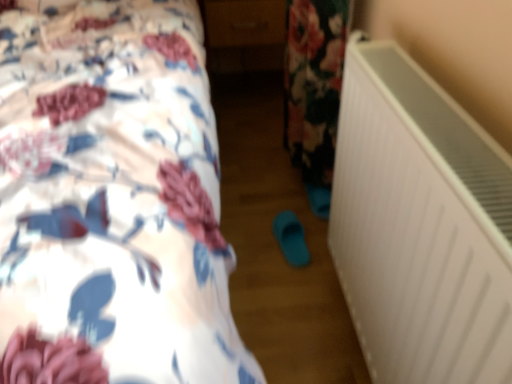
Where is `matte brown drawer at center`? The height and width of the screenshot is (384, 512). matte brown drawer at center is located at coordinates (244, 22).

Measure the distance between white matte radiator at right and camera.

The depth of white matte radiator at right is 16.87 inches.

The width and height of the screenshot is (512, 384). What do you see at coordinates (420, 226) in the screenshot?
I see `white matte radiator at right` at bounding box center [420, 226].

What are the coordinates of `matte brown drawer at center` in the screenshot? It's located at coord(244,22).

Is floral fabric bed at upper left facing away from white matte radiator at right?

floral fabric bed at upper left does not have its back to white matte radiator at right.

Would you say floral fabric bed at upper left is a long distance from white matte radiator at right?

floral fabric bed at upper left is near white matte radiator at right, not far away.

Measure the distance between floral fabric bed at upper left and white matte radiator at right.

floral fabric bed at upper left is 18.12 inches away from white matte radiator at right.

From the image's perspective, is floral fabric bed at upper left positioned above or below white matte radiator at right?

Clearly, from the image's perspective, floral fabric bed at upper left is above white matte radiator at right.

Considering the positions of objects teal rubber slipper at center and white matte radiator at right in the image provided, who is more to the right, teal rubber slipper at center or white matte radiator at right?

white matte radiator at right.

Does point (277, 220) lie in front of point (343, 211)?

No, it is not.

Who is smaller, teal rubber slipper at center or white matte radiator at right?

teal rubber slipper at center.

At what (x,y) coordinates should I click in order to perform the action: click on footwear to the left of white matte radiator at right. Please return your answer as a coordinate pair (x, y). Looking at the image, I should click on (291, 238).

Considering the sizes of objects white matte radiator at right and teal rubber slipper at center in the image provided, who is wider, white matte radiator at right or teal rubber slipper at center?

With larger width is white matte radiator at right.

Can you tell me how much white matte radiator at right and teal rubber slipper at center differ in facing direction?

The angular difference between white matte radiator at right and teal rubber slipper at center is 7.31 degrees.

Looking at this image, is white matte radiator at right far away from teal rubber slipper at center?

No, white matte radiator at right is not far away from teal rubber slipper at center.

In the scene shown: Which is more to the right, white matte radiator at right or teal rubber slipper at center?

Positioned to the right is white matte radiator at right.

Does matte brown drawer at center have a lesser height compared to teal rubber slipper at center?

No.

Consider the image. Does matte brown drawer at center appear on the left side of teal rubber slipper at center?

Yes, matte brown drawer at center is to the left of teal rubber slipper at center.

In the scene shown: From the image's perspective, is matte brown drawer at center above teal rubber slipper at center?

Indeed, from the image's perspective, matte brown drawer at center is shown above teal rubber slipper at center.

From a real-world perspective, is matte brown drawer at center located higher than teal rubber slipper at center?

Yes, from a real-world perspective, matte brown drawer at center is above teal rubber slipper at center.

From a real-world perspective, which is physically above, floral fabric bed at upper left or teal rubber slipper at center?

floral fabric bed at upper left.

Could you tell me if floral fabric bed at upper left is turned towards teal rubber slipper at center?

No, floral fabric bed at upper left is not facing towards teal rubber slipper at center.

Is floral fabric bed at upper left surrounding teal rubber slipper at center?

Definitely not — teal rubber slipper at center is not inside floral fabric bed at upper left.

Which object is more forward, floral fabric bed at upper left or teal rubber slipper at center?

Positioned in front is floral fabric bed at upper left.

From the image's perspective, is white matte radiator at right located beneath floral fabric bed at upper left?

Yes.

Which of these two, white matte radiator at right or floral fabric bed at upper left, is wider?

With larger width is floral fabric bed at upper left.

Based on their sizes in the image, would you say white matte radiator at right is bigger or smaller than floral fabric bed at upper left?

white matte radiator at right is smaller than floral fabric bed at upper left.

Is teal rubber slipper at center thinner than floral fabric bed at upper left?

Indeed, teal rubber slipper at center has a lesser width compared to floral fabric bed at upper left.

From the image's perspective, who appears lower, teal rubber slipper at center or floral fabric bed at upper left?

teal rubber slipper at center is shown below in the image.

Where is `bed that appears in front of the teal rubber slipper at center`? This screenshot has height=384, width=512. bed that appears in front of the teal rubber slipper at center is located at coordinates (112, 199).

Is teal rubber slipper at center at the right side of floral fabric bed at upper left?

Indeed, teal rubber slipper at center is positioned on the right side of floral fabric bed at upper left.

Identify the location of air conditioning that is on the right side of floral fabric bed at upper left. The width and height of the screenshot is (512, 384). (420, 226).

The width and height of the screenshot is (512, 384). What are the coordinates of `footwear below the white matte radiator at right (from a real-world perspective)` in the screenshot? It's located at (291, 238).

When comparing their distances from floral fabric bed at upper left, does teal rubber slipper at center or white matte radiator at right seem further?

teal rubber slipper at center lies further to floral fabric bed at upper left than the other object.

In the scene shown: From the image, which object appears to be nearer to white matte radiator at right, teal rubber slipper at center or matte brown drawer at center?

The object closer to white matte radiator at right is teal rubber slipper at center.

From the image, which object appears to be nearer to teal rubber slipper at center, white matte radiator at right or matte brown drawer at center?

white matte radiator at right lies closer to teal rubber slipper at center than the other object.

Which object lies nearer to the anchor point white matte radiator at right, teal rubber slipper at center or floral fabric bed at upper left?

floral fabric bed at upper left lies closer to white matte radiator at right than the other object.

Looking at the image, which one is located closer to teal rubber slipper at center, matte brown drawer at center or white matte radiator at right?

Based on the image, white matte radiator at right appears to be nearer to teal rubber slipper at center.

Looking at the image, which one is located further to matte brown drawer at center, floral fabric bed at upper left or white matte radiator at right?

Among the two, white matte radiator at right is located further to matte brown drawer at center.

Estimate the real-world distances between objects in this image. Which object is closer to teal rubber slipper at center, white matte radiator at right or floral fabric bed at upper left?

white matte radiator at right is positioned closer to the anchor teal rubber slipper at center.

From the image, which object appears to be nearer to teal rubber slipper at center, floral fabric bed at upper left or matte brown drawer at center?

floral fabric bed at upper left is closer to teal rubber slipper at center.

Identify the location of air conditioning between floral fabric bed at upper left and teal rubber slipper at center from front to back. (420, 226).

The width and height of the screenshot is (512, 384). What are the coordinates of `air conditioning between floral fabric bed at upper left and matte brown drawer at center along the z-axis` in the screenshot? It's located at (420, 226).

This screenshot has height=384, width=512. Find the location of `footwear between white matte radiator at right and matte brown drawer at center from front to back`. footwear between white matte radiator at right and matte brown drawer at center from front to back is located at coordinates (291, 238).

You are a GUI agent. You are given a task and a screenshot of the screen. Output one action in this format:
    pyautogui.click(x=<x>, y=<y>)
    Task: Click on the footwear between floral fabric bed at upper left and matte brown drawer at center in the front-back direction
    Image resolution: width=512 pixels, height=384 pixels.
    Given the screenshot: What is the action you would take?
    pyautogui.click(x=291, y=238)